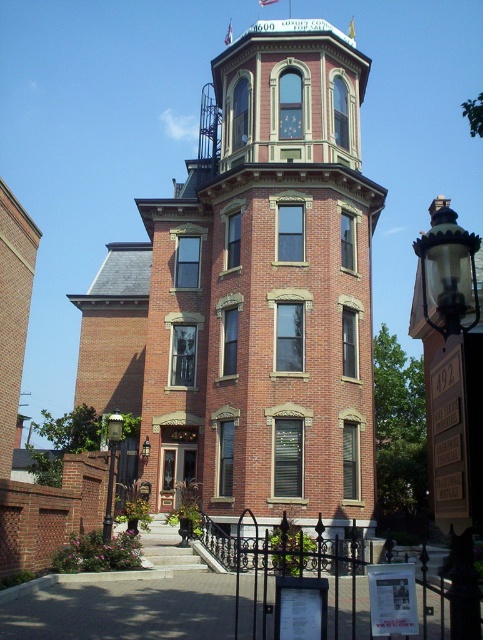
You are an architect evaluating the symmetry of the Victorian building. You notice the matte glass clock at upper center and the matte black lamp at upper center. Which object has a greater width?

The matte glass clock at upper center has a greater width than the matte black lamp at upper center.

You are standing in front of the Victorian brick building and notice two objects in the scene. The black metal streetlamp at lower left and the matte glass clock at upper center. Which object is taller?

The black metal streetlamp at lower left is taller than the matte glass clock at upper center.